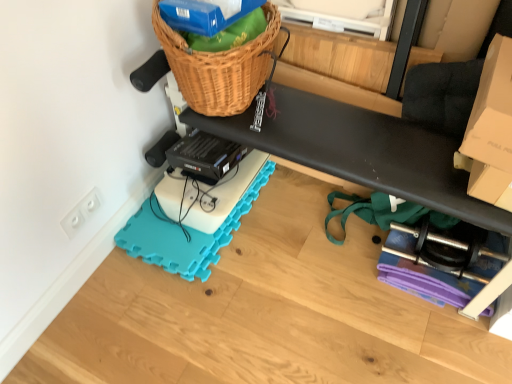
Locate an element on the screen. This screenshot has height=384, width=512. free spot to the right of teal foam yoga mat at lower left is located at coordinates (300, 235).